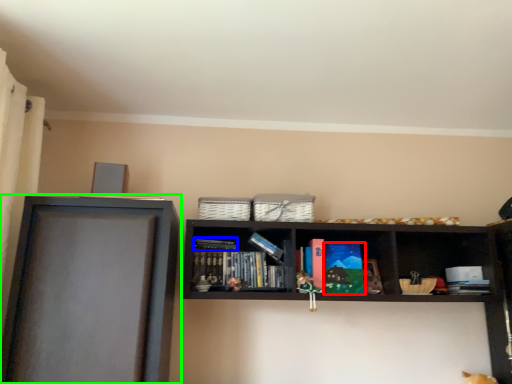
Question: Considering the real-world distances, which object is closest to paperback book (highlighted by a red box)? book (highlighted by a blue box) or shelf (highlighted by a green box).

Choices:
 (A) book
 (B) shelf

Answer: (A)